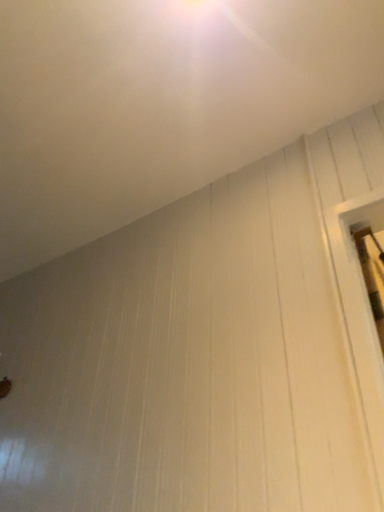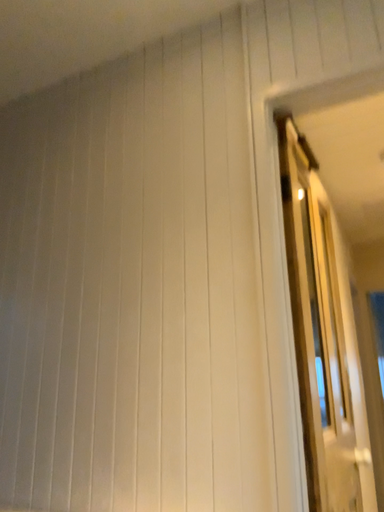
Question: How did the camera likely rotate when shooting the video?

Choices:
 (A) rotated left
 (B) rotated right

Answer: (B)